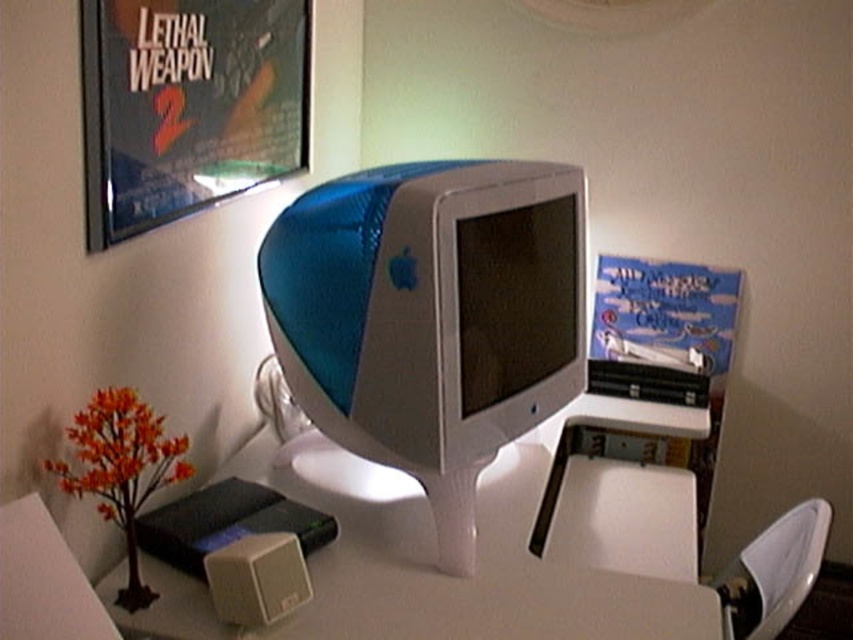
Question: Which of the following is the closest to the observer?

Choices:
 (A) matte plastic poster at upper left
 (B) white glossy table at center

Answer: (A)

Question: Which object appears farthest from the camera in this image?

Choices:
 (A) matte plastic poster at upper left
 (B) white glossy table at center

Answer: (B)

Question: Which of these objects is positioned closest to the white glossy table at center?

Choices:
 (A) matte plastic poster at upper left
 (B) blue plastic monitor at center

Answer: (B)

Question: Is blue plastic monitor at center thinner than white glossy table at center?

Choices:
 (A) no
 (B) yes

Answer: (B)

Question: Can you confirm if blue plastic monitor at center is positioned to the right of white glossy table at center?

Choices:
 (A) no
 (B) yes

Answer: (A)

Question: Is white glossy table at center thinner than matte plastic poster at upper left?

Choices:
 (A) no
 (B) yes

Answer: (A)